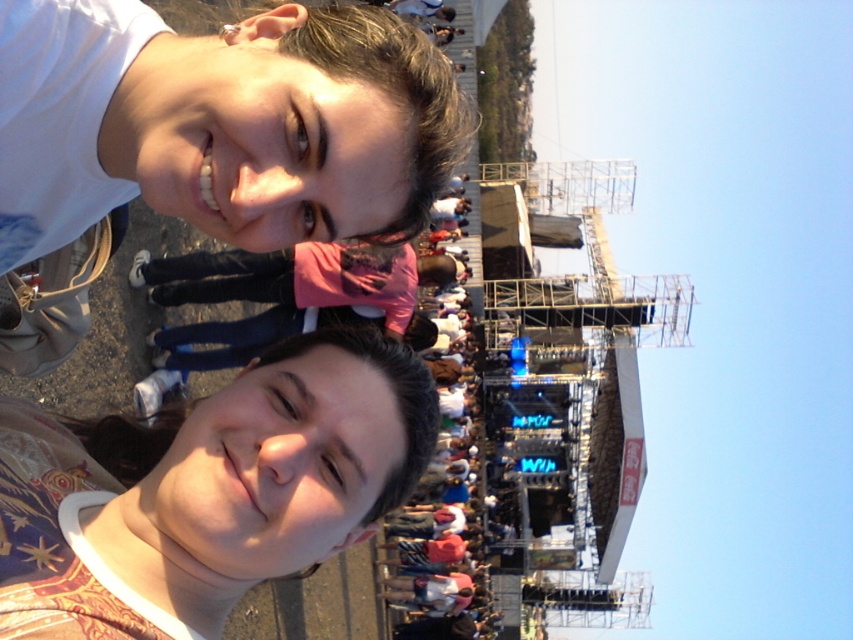
Question: Which object is farther from the camera taking this photo?

Choices:
 (A) matte white face at upper left
 (B) matte floral shirt at lower left

Answer: (A)

Question: From the image, what is the correct spatial relationship of matte white face at upper left in relation to matte floral shirt at lower left?

Choices:
 (A) right
 (B) left

Answer: (A)

Question: Can you confirm if matte white face at upper left is positioned to the left of matte floral shirt at lower left?

Choices:
 (A) yes
 (B) no

Answer: (B)

Question: Does matte white face at upper left appear under matte floral shirt at lower left?

Choices:
 (A) yes
 (B) no

Answer: (B)